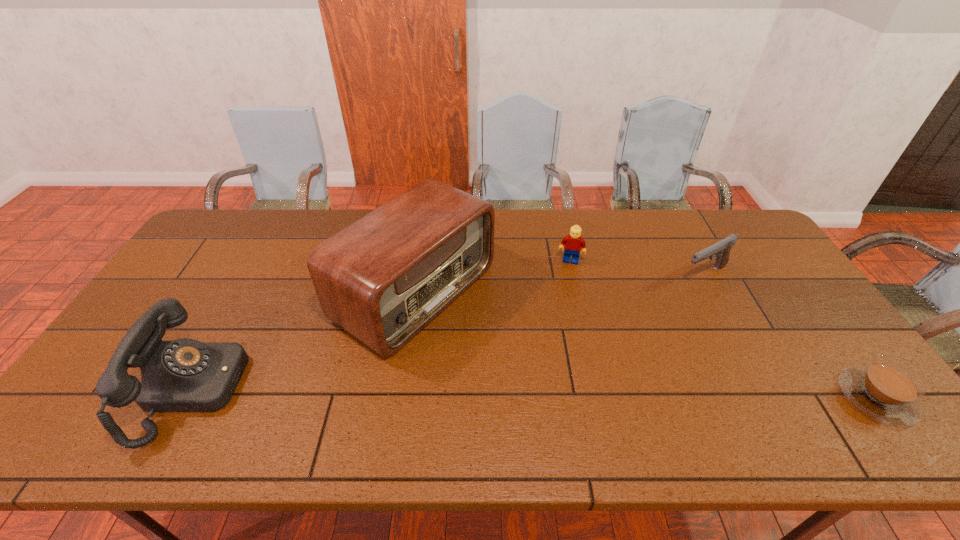
Image resolution: width=960 pixels, height=540 pixels. I want to click on empty space between the shortest object and the second object from left to right, so click(645, 345).

Locate an element on the screen. The height and width of the screenshot is (540, 960). vacant area that lies between the telephone and the tallest object is located at coordinates (304, 341).

Identify the location of free space that is in between the third object from right to left and the pistol. (637, 268).

Locate an element on the screen. This screenshot has width=960, height=540. empty space that is in between the second object from right to left and the Lego is located at coordinates (637, 268).

Where is `free spot between the fourth object from left to right and the leftmost object`? This screenshot has width=960, height=540. free spot between the fourth object from left to right and the leftmost object is located at coordinates (449, 332).

The height and width of the screenshot is (540, 960). Identify the location of empty space between the Lego and the pistol. (637, 268).

Identify the location of vacant area that lies between the radio receiver and the telephone. (304, 341).

Image resolution: width=960 pixels, height=540 pixels. I want to click on unoccupied position between the second object from left to right and the third object from right to left, so click(493, 276).

Identify the location of vacant area that lies between the second object from right to left and the Lego. [x=637, y=268].

Find the location of a particular element. Image resolution: width=960 pixels, height=540 pixels. object that can be found as the closest to the fourth object from right to left is located at coordinates (185, 375).